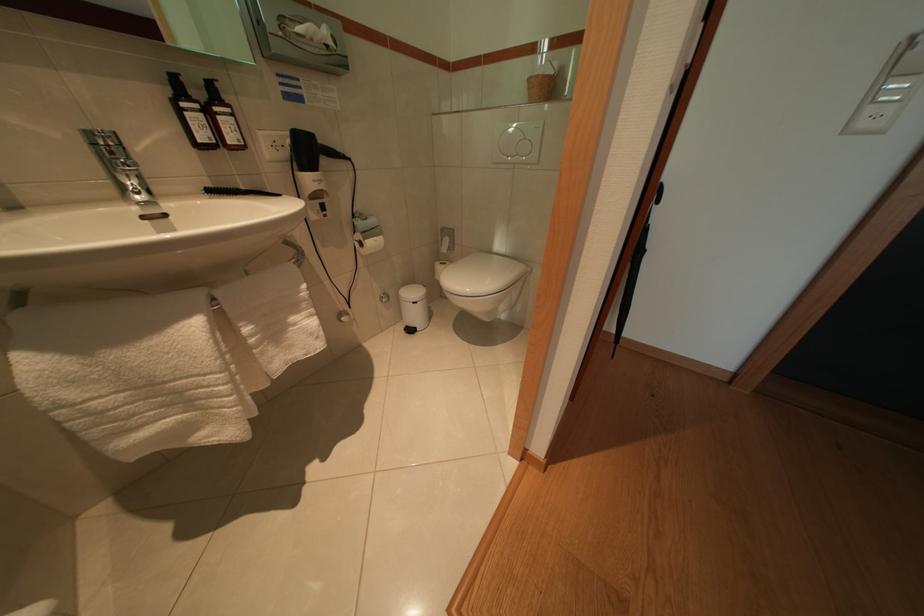
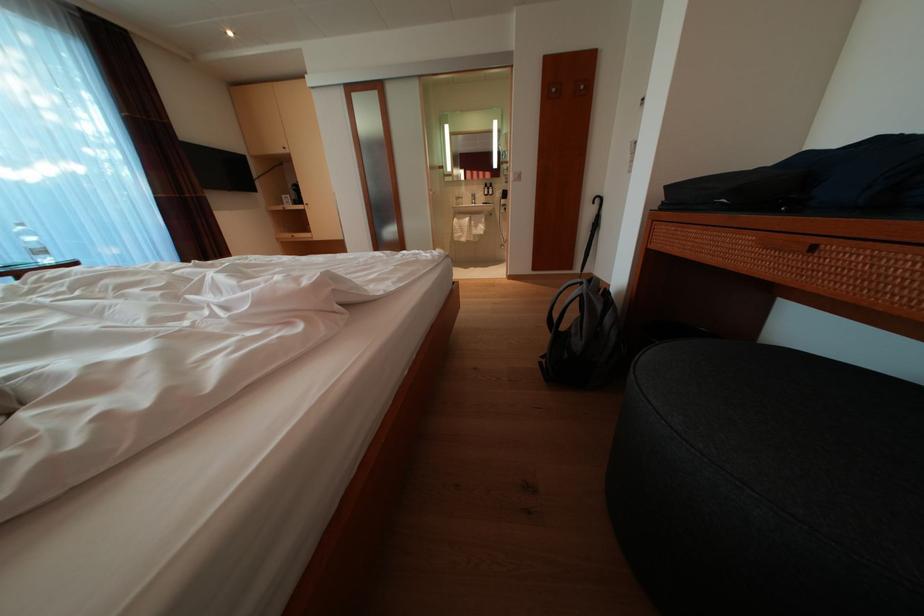
The point at [202,333] is marked in the first image. Where is the corresponding point in the second image?

(476, 225)